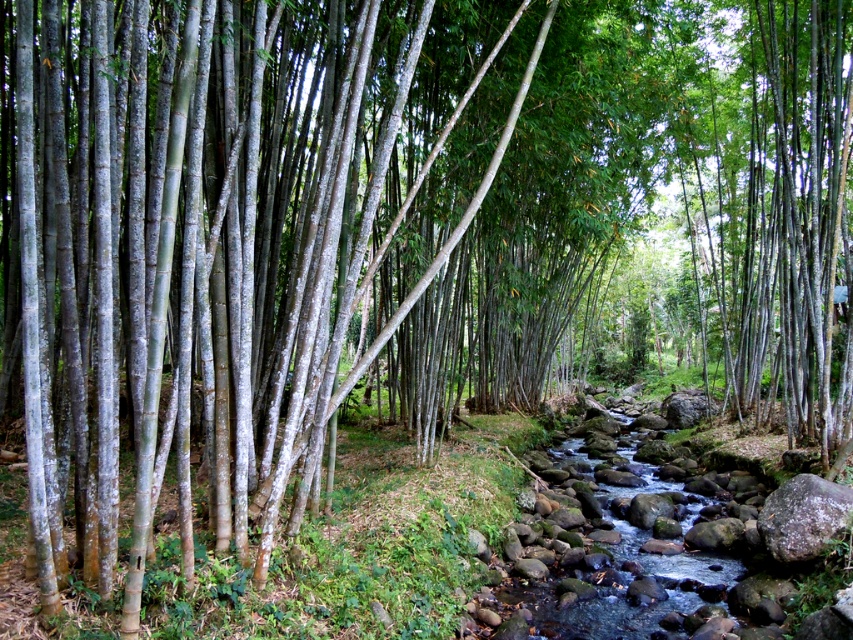
You are a frog that needs to jump across the stream. The smooth gray rocks at center and gray rough rock at lower right are in your path. Which rock is wider to land on?

The smooth gray rocks at center might be wider than gray rough rock at lower right, so the frog should aim for the smooth gray rocks at center for a safer landing.

You are a hiker trying to cross the stream in the bamboo grove. You notice two rocks to step on. The smooth gray rocks at center and the gray rough rock at lower right. Which rock is bigger?

The smooth gray rocks at center is larger in size than the gray rough rock at lower right.